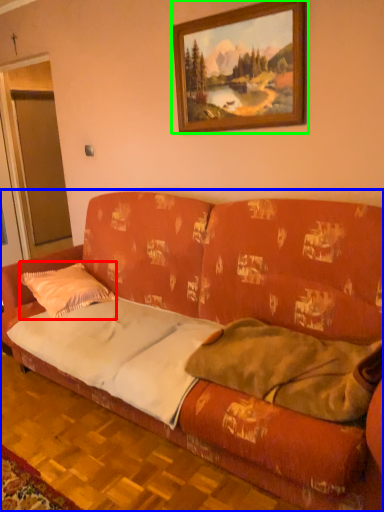
Question: Which is farther away from throw pillow (highlighted by a red box)? studio couch (highlighted by a blue box) or picture frame (highlighted by a green box)?

Choices:
 (A) studio couch
 (B) picture frame

Answer: (B)